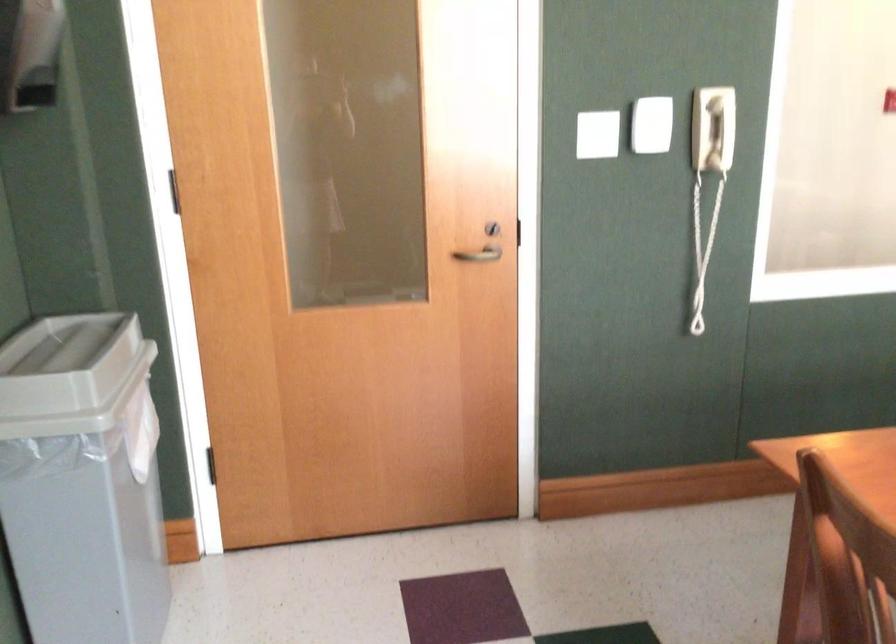
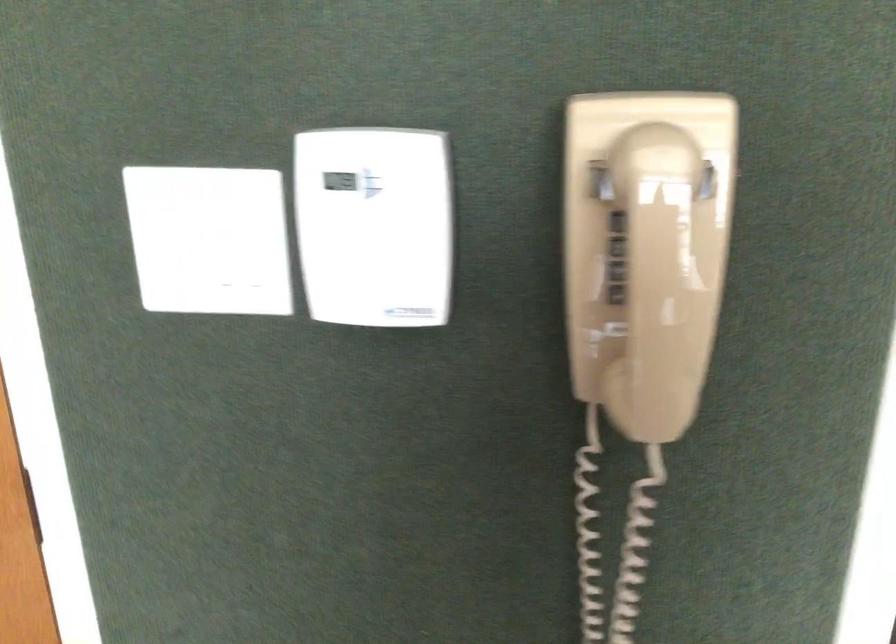
The images are taken continuously from a first-person perspective. In which direction are you moving?

The cameraman moved toward right, forward.